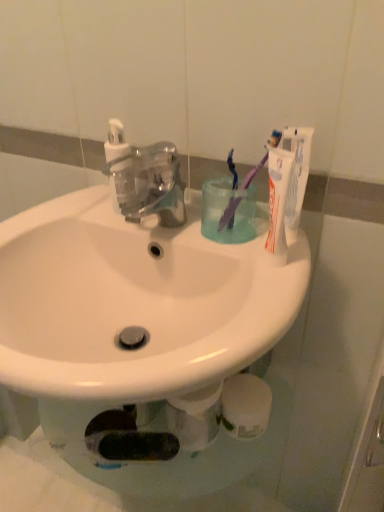
In order to click on free space to the left of transparent plastic soap dispenser at upper left in this screenshot , I will do `click(63, 211)`.